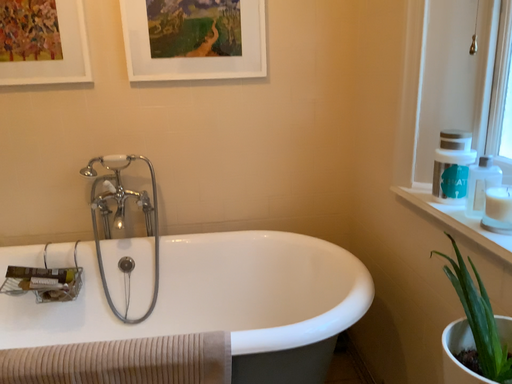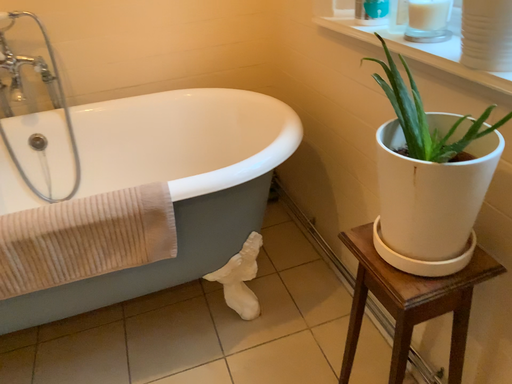
Question: Which way did the camera rotate in the video?

Choices:
 (A) rotated downward
 (B) rotated upward

Answer: (A)